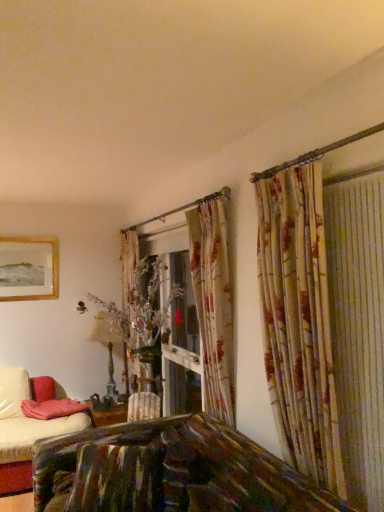
Question: From their relative heights in the image, would you say antique brass table lamp at center is taller or shorter than wooden framed picture at upper left?

Choices:
 (A) tall
 (B) short

Answer: (A)

Question: Is antique brass table lamp at center inside or outside of wooden framed picture at upper left?

Choices:
 (A) inside
 (B) outside

Answer: (B)

Question: Estimate the real-world distances between objects in this image. Which object is closer to the antique brass table lamp at center?

Choices:
 (A) pink fabric pillow at lower left
 (B) wooden framed picture at upper left

Answer: (A)

Question: Which object is the farthest from the antique brass table lamp at center?

Choices:
 (A) wooden framed picture at upper left
 (B) pink fabric pillow at lower left

Answer: (A)